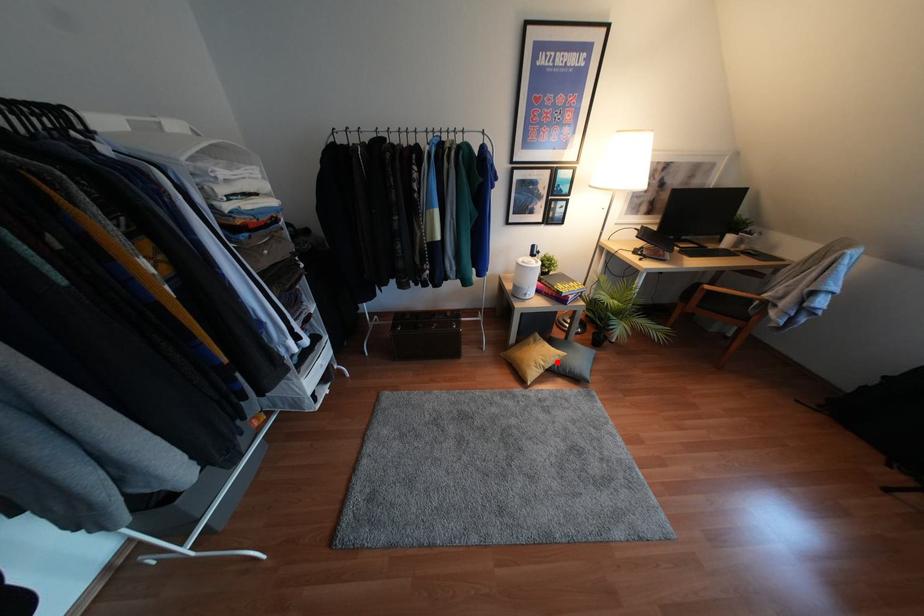
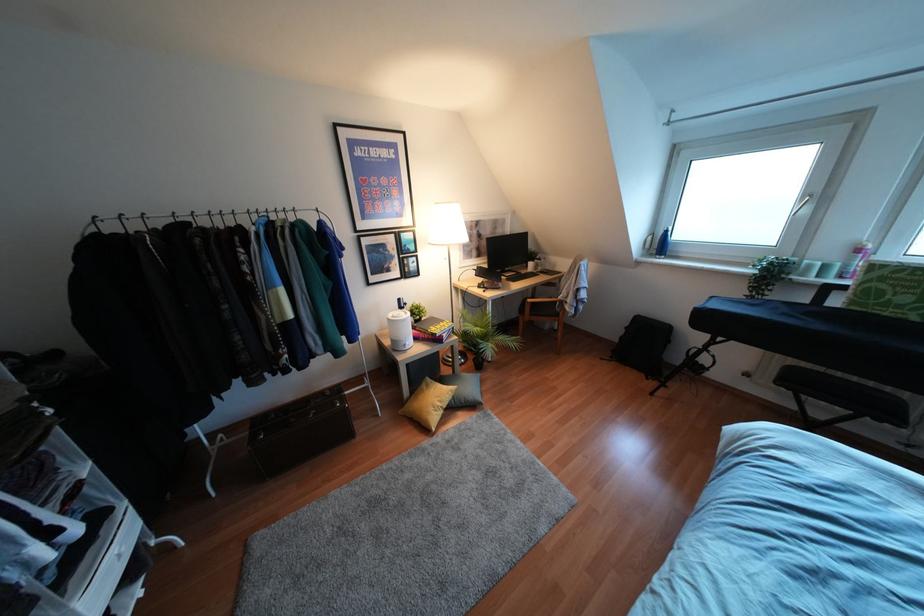
Question: A red point is marked in image1. In image2, is the corresponding 3D point closer to the camera or farther? Reply with the corresponding letter.

Choices:
 (A) The corresponding 3D point is closer.
 (B) The corresponding 3D point is farther.

Answer: (A)